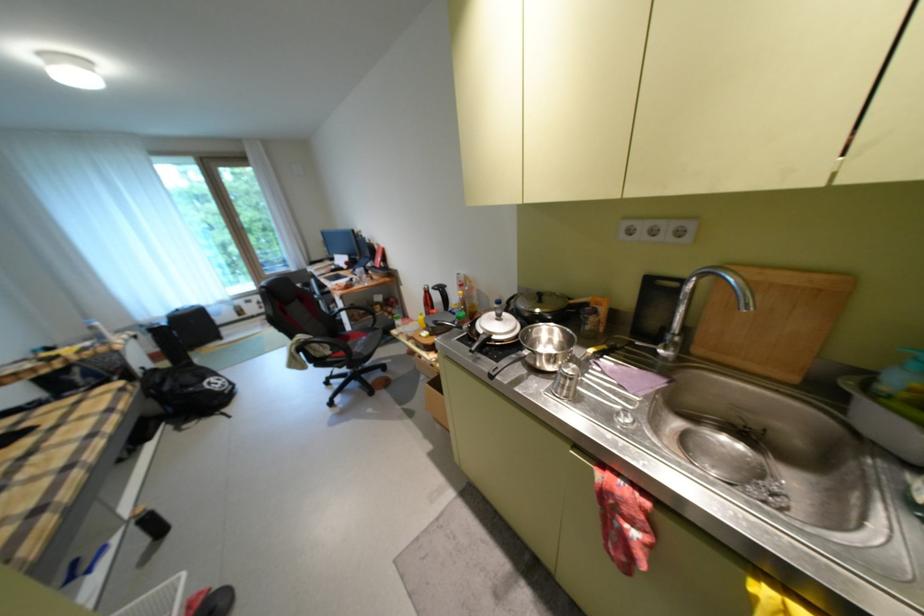
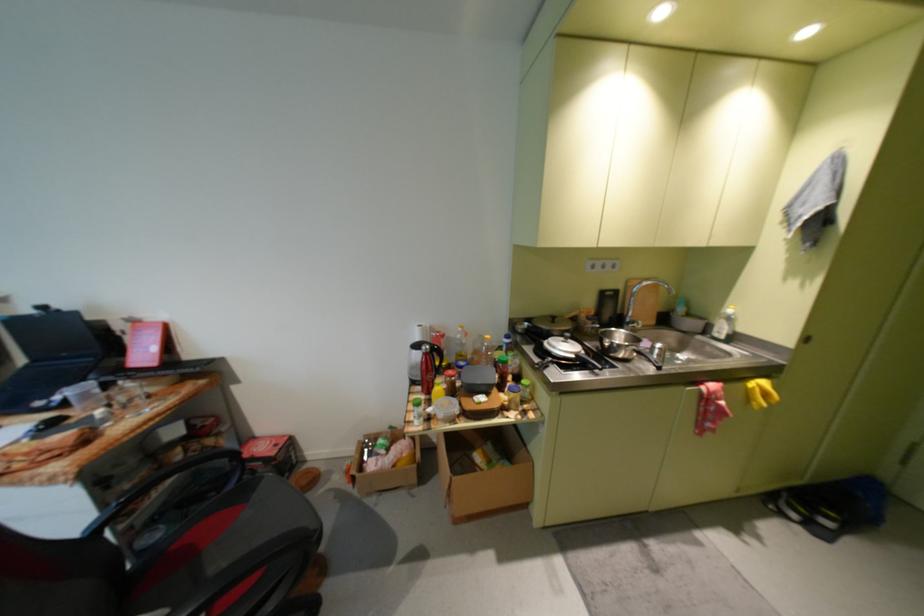
Find the pixel in the second image that matches point (493, 334) in the first image.

(586, 357)